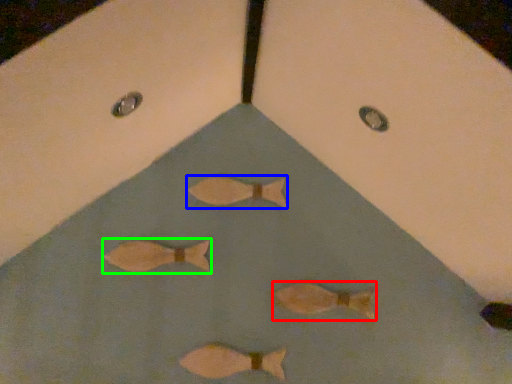
Question: Which object is the closest to the fish (highlighted by a red box)? Choose among these: fish (highlighted by a blue box) or fish (highlighted by a green box).

Choices:
 (A) fish
 (B) fish

Answer: (A)